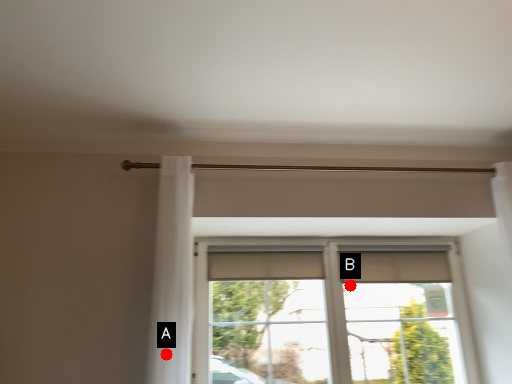
Question: Two points are circled on the image, labeled by A and B beside each circle. Among these points, which one is farthest from the camera?

Choices:
 (A) A is further
 (B) B is further

Answer: (B)